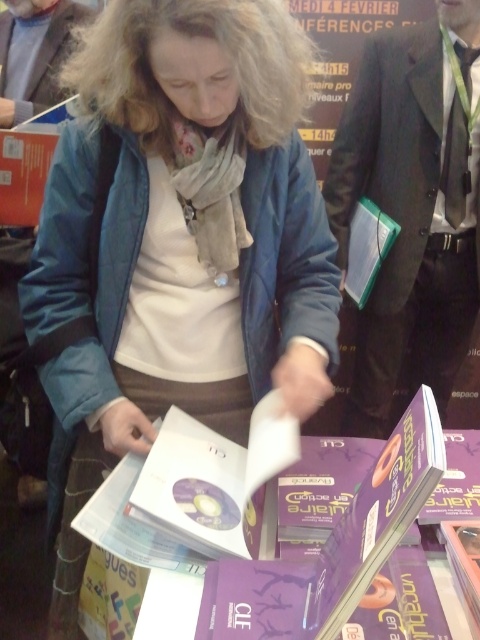
You are a photographer at the event and want to take a picture of the transparent plastic book at center. To avoid including the gray wool scarf at upper center in the frame, which direction should you move the camera?

Move the camera to the left, as the gray wool scarf at upper center is to the left of the transparent plastic book at center. By moving the camera left, the scarf will be out of frame while keeping the book centered.

You are a photographer trying to capture the woman holding the stack of books. You notice two points in the image at coordinates point (8, 36) and point (383, 259). Which point is closer to your camera lens?

Point (8, 36) is further to the camera than point (383, 259), so the point closer to the camera lens is point (383, 259).